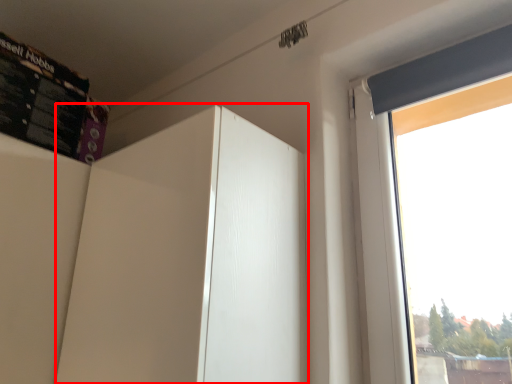
Question: From the image's perspective, what is the correct spatial positioning of screen door (annotated by the red box) in reference to bulletin board?

Choices:
 (A) below
 (B) above

Answer: (A)